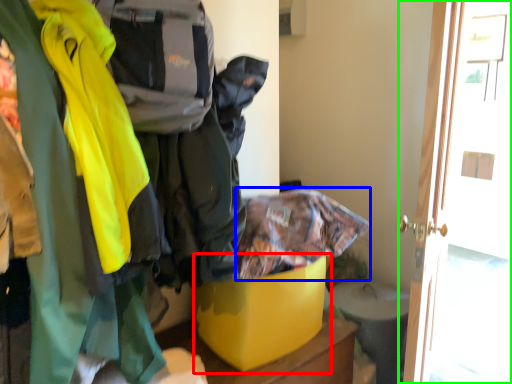
Question: Estimate the real-world distances between objects in this image. Which object is closer to storage box (highlighted by a red box), cloak (highlighted by a blue box) or door (highlighted by a green box)?

Choices:
 (A) cloak
 (B) door

Answer: (A)